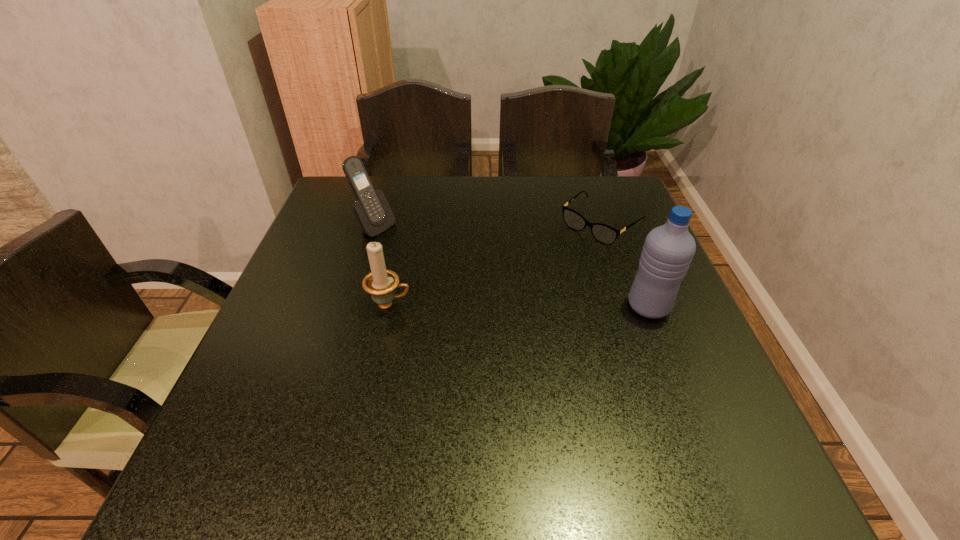
At what (x,y) coordinates should I click in order to perform the action: click on vacant position located 0.210m on the front-facing side of the spectacles. Please return your answer as a coordinate pair (x, y). Looking at the image, I should click on (529, 282).

I want to click on free point located 0.090m on the front-facing side of the spectacles, so click(x=559, y=259).

The height and width of the screenshot is (540, 960). What are the coordinates of `cellular telephone present at the far edge` in the screenshot? It's located at (372, 211).

The height and width of the screenshot is (540, 960). Identify the location of spectacles that is at the far edge. (603, 233).

Find the location of `object positioned at the left edge`. object positioned at the left edge is located at coordinates (372, 211).

I want to click on water bottle situated at the right edge, so click(x=668, y=250).

You are a GUI agent. You are given a task and a screenshot of the screen. Output one action in this format:
    pyautogui.click(x=<x>, y=<y>)
    Task: Click on the spectacles that is at the right edge
    This screenshot has width=960, height=540.
    Given the screenshot: What is the action you would take?
    (603, 233)

Locate an element on the screen. object that is at the far left corner is located at coordinates click(372, 211).

I want to click on object located at the far right corner, so click(603, 233).

This screenshot has width=960, height=540. Find the location of `free space at the far edge of the desktop`. free space at the far edge of the desktop is located at coordinates (493, 211).